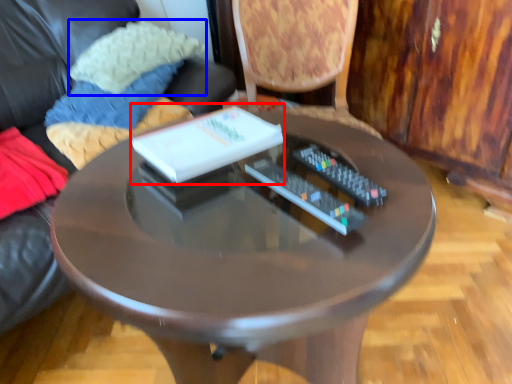
Question: Which of the following is the closest to the observer, book (highlighted by a red box) or pillow (highlighted by a blue box)?

Choices:
 (A) book
 (B) pillow

Answer: (A)